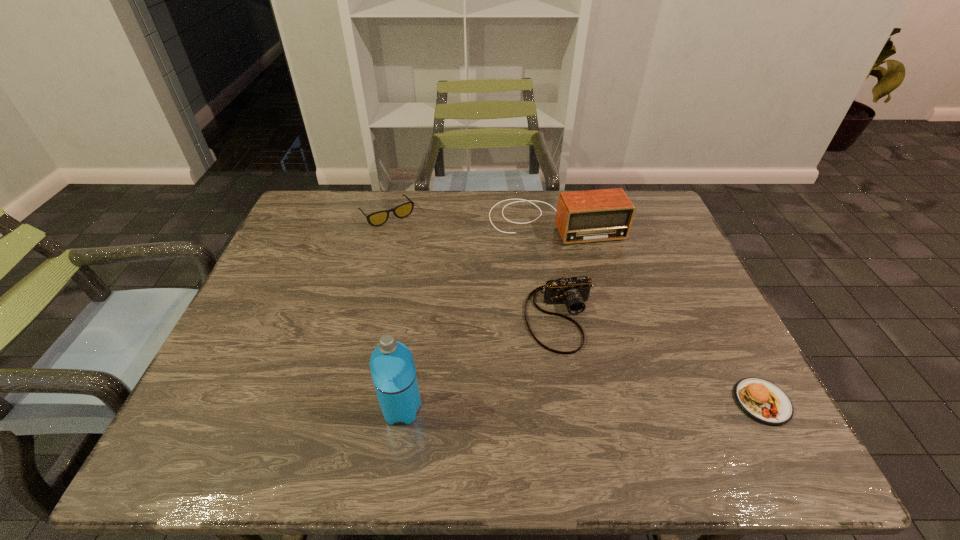
Locate an element on the screen. This screenshot has height=540, width=960. free space at the far right corner of the desktop is located at coordinates (654, 195).

The width and height of the screenshot is (960, 540). In order to click on vacant space in between the second object from left to right and the radio receiver in this screenshot , I will do `click(478, 315)`.

You are a GUI agent. You are given a task and a screenshot of the screen. Output one action in this format:
    pyautogui.click(x=<x>, y=<y>)
    Task: Click on the free space between the patty and the fourth shortest object
    Image resolution: width=960 pixels, height=540 pixels.
    Given the screenshot: What is the action you would take?
    pyautogui.click(x=659, y=312)

Where is `vacant space in between the third nearest object and the second object from left to right`? The width and height of the screenshot is (960, 540). vacant space in between the third nearest object and the second object from left to right is located at coordinates (481, 363).

Locate an element on the screen. The width and height of the screenshot is (960, 540). free space between the leftmost object and the radio receiver is located at coordinates pyautogui.click(x=471, y=218).

You are a GUI agent. You are given a task and a screenshot of the screen. Output one action in this format:
    pyautogui.click(x=<x>, y=<y>)
    Task: Click on the empty location between the fourth object from right to left and the third shortest object
    This screenshot has height=540, width=960.
    Given the screenshot: What is the action you would take?
    pyautogui.click(x=481, y=363)

This screenshot has width=960, height=540. I want to click on vacant space in between the second object from left to right and the radio receiver, so click(478, 315).

At what (x,y) coordinates should I click in order to perform the action: click on vacant space that's between the second tallest object and the second object from left to right. Please return your answer as a coordinate pair (x, y). This screenshot has height=540, width=960. Looking at the image, I should click on (478, 315).

Find the location of `vacant space that's between the rightmost object and the radio receiver`. vacant space that's between the rightmost object and the radio receiver is located at coordinates (659, 312).

Select which object appears as the second closest to the third nearest object. Please provide its 2D coordinates. Your answer should be formatted as a tuple, i.e. [(x, y)], where the tuple contains the x and y coordinates of a point satisfying the conditions above.

[(393, 372)]